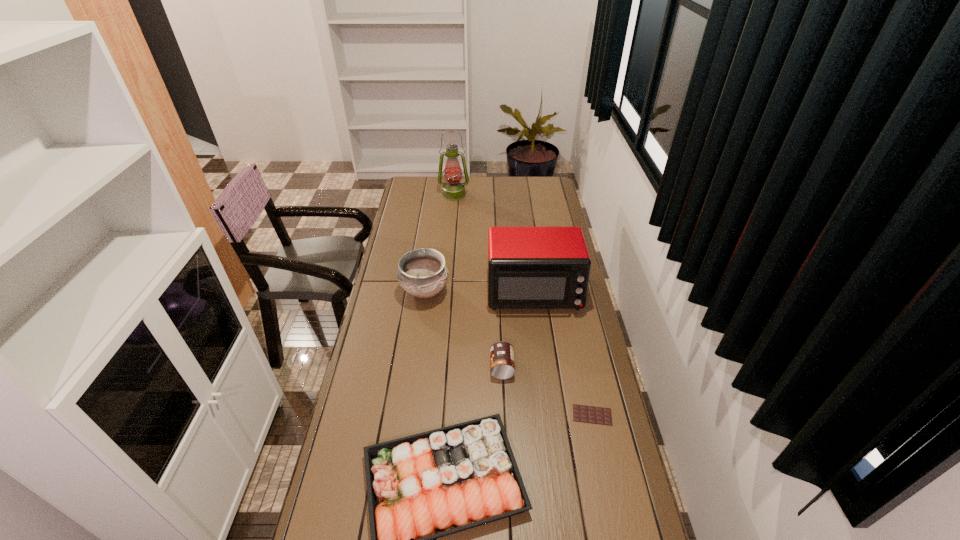
Where is `the tallest object`? The image size is (960, 540). the tallest object is located at coordinates (453, 190).

In order to click on the farthest object in this screenshot , I will do `click(453, 190)`.

You are a GUI agent. You are given a task and a screenshot of the screen. Output one action in this format:
    pyautogui.click(x=<x>, y=<y>)
    Task: Click on the toaster oven
    
    Given the screenshot: What is the action you would take?
    pyautogui.click(x=528, y=267)

I want to click on pottery, so click(x=422, y=272).

Where is `can`? The height and width of the screenshot is (540, 960). can is located at coordinates (501, 353).

Identify the location of the fourth farthest object. This screenshot has height=540, width=960. (501, 353).

The width and height of the screenshot is (960, 540). Identify the location of the shortest object. (589, 414).

Locate an element on the screen. free location located 0.070m on the left of the oil lamp is located at coordinates (426, 195).

Where is `vacant region located on the front-facing side of the fifth shortest object`? Image resolution: width=960 pixels, height=540 pixels. vacant region located on the front-facing side of the fifth shortest object is located at coordinates (545, 380).

Locate an element on the screen. free spot located 0.180m on the right of the fourth shortest object is located at coordinates (492, 292).